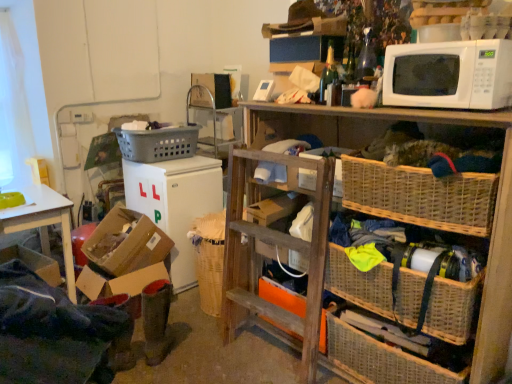
Question: From the image's perspective, is woven wood shelf at upper right under orange cardboard box at center?

Choices:
 (A) yes
 (B) no

Answer: (B)

Question: Is woven wood shelf at upper right closer to the viewer compared to orange cardboard box at center?

Choices:
 (A) yes
 (B) no

Answer: (A)

Question: Can you confirm if woven wood shelf at upper right is wider than orange cardboard box at center?

Choices:
 (A) no
 (B) yes

Answer: (B)

Question: Considering the relative positions of woven wood shelf at upper right and orange cardboard box at center in the image provided, is woven wood shelf at upper right to the right of orange cardboard box at center from the viewer's perspective?

Choices:
 (A) yes
 (B) no

Answer: (A)

Question: Does woven wood shelf at upper right have a lesser width compared to orange cardboard box at center?

Choices:
 (A) no
 (B) yes

Answer: (A)

Question: Is point (459, 102) positioned closer to the camera than point (438, 296)?

Choices:
 (A) farther
 (B) closer

Answer: (B)

Question: Relative to woven wicker basket at lower right, is white matte microwave at upper right in front or behind?

Choices:
 (A) front
 (B) behind

Answer: (A)

Question: Is white matte microwave at upper right inside the boundaries of woven wicker basket at lower right, or outside?

Choices:
 (A) inside
 (B) outside

Answer: (B)

Question: From a real-world perspective, is white matte microwave at upper right above or below woven wicker basket at lower right?

Choices:
 (A) above
 (B) below

Answer: (A)

Question: Is cardboard box at lower left, arranged as the second box when viewed from the top, bigger or smaller than green felt boots at lower left?

Choices:
 (A) big
 (B) small

Answer: (A)

Question: Relative to green felt boots at lower left, is cardboard box at lower left, which appears as the first box when ordered from the bottom, in front or behind?

Choices:
 (A) behind
 (B) front

Answer: (A)

Question: Considering the positions of cardboard box at lower left, arranged as the second box when viewed from the top, and green felt boots at lower left in the image, is cardboard box at lower left, arranged as the second box when viewed from the top, taller or shorter than green felt boots at lower left?

Choices:
 (A) short
 (B) tall

Answer: (A)

Question: Considering the positions of cardboard box at lower left, which appears as the first box when ordered from the bottom, and green felt boots at lower left in the image, is cardboard box at lower left, which appears as the first box when ordered from the bottom, wider or thinner than green felt boots at lower left?

Choices:
 (A) wide
 (B) thin

Answer: (A)

Question: Looking at their shapes, would you say woven wicker basket at lower right is wider or thinner than cardboard box at lower left, which appears as the first box when ordered from the bottom?

Choices:
 (A) wide
 (B) thin

Answer: (B)

Question: Is woven wicker basket at lower right in front of or behind cardboard box at lower left, arranged as the second box when viewed from the top, in the image?

Choices:
 (A) front
 (B) behind

Answer: (A)